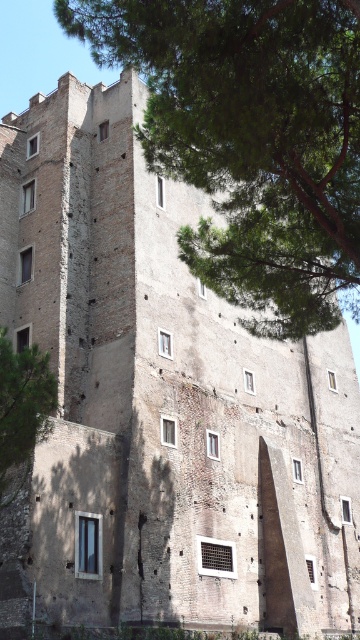
Question: Which object is farther from the camera taking this photo?

Choices:
 (A) green leafy tree at left
 (B) green leafy tree at upper center

Answer: (A)

Question: Which object appears farthest from the camera in this image?

Choices:
 (A) green leafy tree at upper center
 (B) green leafy tree at left

Answer: (B)

Question: Where is green leafy tree at upper center located in relation to green leafy tree at left in the image?

Choices:
 (A) left
 (B) right

Answer: (B)

Question: Does green leafy tree at upper center have a lesser width compared to green leafy tree at left?

Choices:
 (A) yes
 (B) no

Answer: (B)

Question: Can you confirm if green leafy tree at upper center is positioned to the left of green leafy tree at left?

Choices:
 (A) no
 (B) yes

Answer: (A)